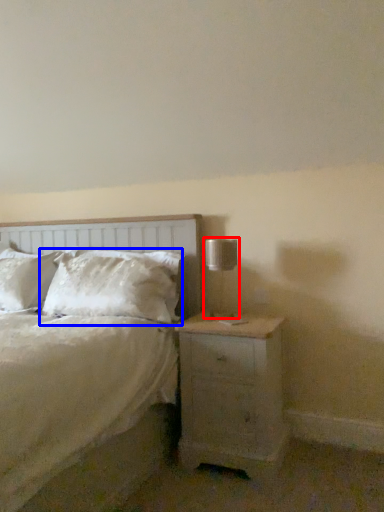
Question: Which object appears farthest to the camera in this image, table lamp (highlighted by a red box) or pillow (highlighted by a blue box)?

Choices:
 (A) table lamp
 (B) pillow

Answer: (B)